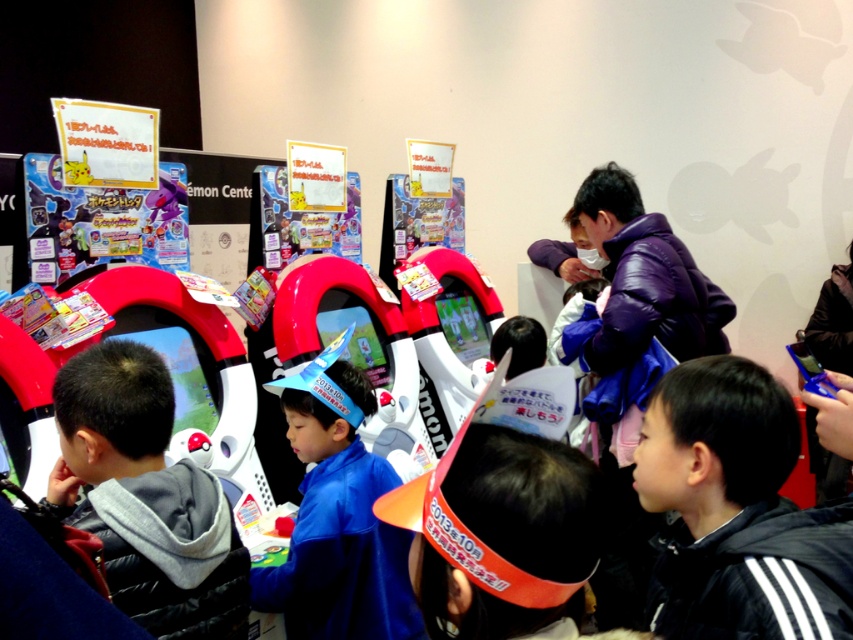
Which is behind, point (184, 564) or point (338, 433)?

Positioned behind is point (338, 433).

Which is below, gray fleece jacket at left or blue fabric hat at center?

blue fabric hat at center

Is point (59, 468) more distant than point (370, 461)?

No.

Find the location of a particular element. Image resolution: width=853 pixels, height=640 pixels. gray fleece jacket at left is located at coordinates (144, 497).

Is black fleece jacket at lower right smaller than blue fabric hat at center?

Yes, black fleece jacket at lower right is smaller than blue fabric hat at center.

Is black fleece jacket at lower right taller than blue fabric hat at center?

No, black fleece jacket at lower right is not taller than blue fabric hat at center.

Locate an element on the screen. This screenshot has width=853, height=640. black fleece jacket at lower right is located at coordinates (737, 513).

This screenshot has width=853, height=640. I want to click on black fleece jacket at lower right, so click(x=737, y=513).

Between point (729, 582) and point (169, 490), which one is positioned behind?

Positioned behind is point (169, 490).

Is point (753, 387) closer to viewer compared to point (126, 465)?

That is True.

I want to click on black fleece jacket at lower right, so click(737, 513).